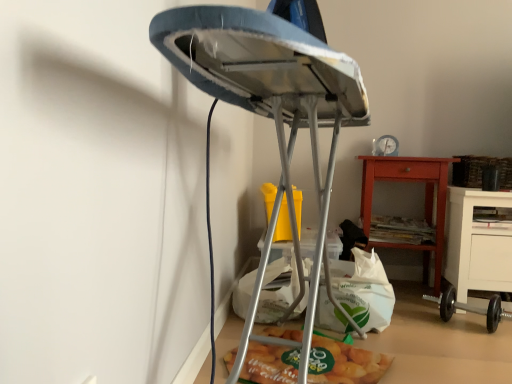
Question: In terms of height, does matte plastic bag of chips at lower center look taller or shorter compared to black rubber dumbbell at lower right?

Choices:
 (A) short
 (B) tall

Answer: (A)

Question: Would you say matte plastic bag of chips at lower center is to the left or to the right of black rubber dumbbell at lower right in the picture?

Choices:
 (A) left
 (B) right

Answer: (A)

Question: Which object is positioned closest to the white paper bag at lower center?

Choices:
 (A) metallic ironing board at center
 (B) matte orange wooden nightstand at lower right
 (C) black rubber dumbbell at lower right
 (D) matte plastic bag of chips at lower center

Answer: (D)

Question: Estimate the real-world distances between objects in this image. Which object is farther from the metallic ironing board at center?

Choices:
 (A) matte plastic bag of chips at lower center
 (B) matte orange wooden nightstand at lower right
 (C) white paper bag at lower center
 (D) black rubber dumbbell at lower right

Answer: (D)